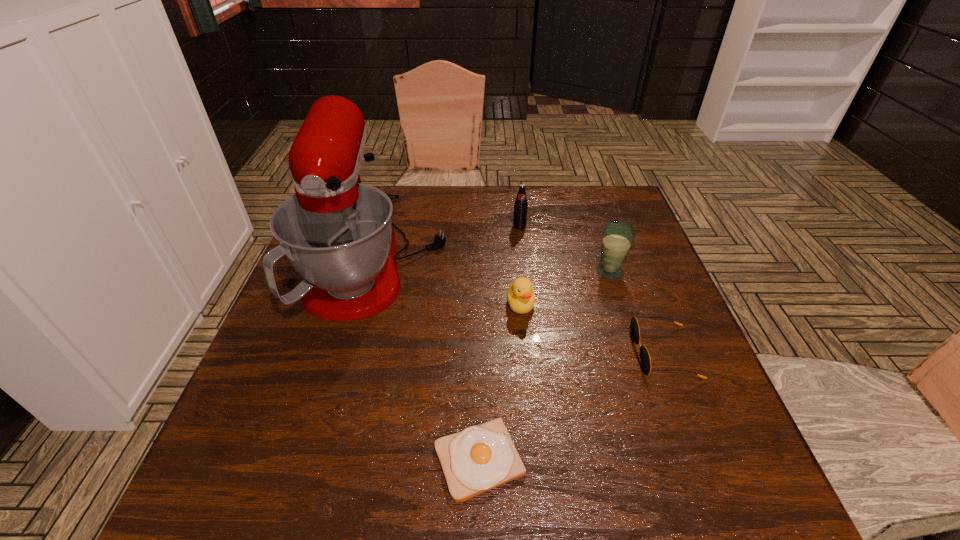
At what (x,y) coordinates should I click in order to perform the action: click on free space between the mixer and the nearest object. Please return your answer as a coordinate pair (x, y). This screenshot has width=960, height=540. Looking at the image, I should click on (430, 356).

Locate an element on the screen. This screenshot has width=960, height=540. vacant space that's between the tallest object and the glass is located at coordinates (495, 262).

This screenshot has width=960, height=540. Identify the location of vacant space in between the glass and the fifth tallest object. (636, 312).

Where is `unoccupied position between the tallest object and the pop`? This screenshot has height=540, width=960. unoccupied position between the tallest object and the pop is located at coordinates (450, 240).

Locate an element on the screen. free space that is in between the toast and the pop is located at coordinates (499, 343).

The height and width of the screenshot is (540, 960). In order to click on free space between the fifth tallest object and the duckling in this screenshot , I will do `click(592, 328)`.

This screenshot has width=960, height=540. I want to click on vacant space that is in between the mixer and the nearest object, so click(x=430, y=356).

Where is `blank region between the duckling and the sunglasses`? blank region between the duckling and the sunglasses is located at coordinates (592, 328).

Find the location of a particular element. The width and height of the screenshot is (960, 540). free space between the duckling and the sunglasses is located at coordinates (592, 328).

Point out which object is positioned as the third nearest to the sunglasses. Please provide its 2D coordinates. Your answer should be formatted as a tuple, i.e. [(x, y)], where the tuple contains the x and y coordinates of a point satisfying the conditions above.

[(482, 457)]